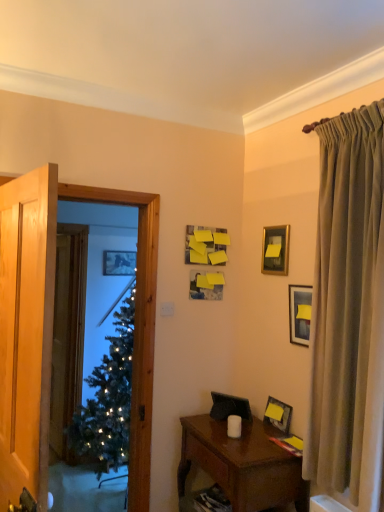
Question: Relative to gold metallic picture frame at upper right, the 5th picture frame when ordered from bottom to top, is brown wooden nightstand at lower right in front or behind?

Choices:
 (A) front
 (B) behind

Answer: (A)

Question: Would you say brown wooden nightstand at lower right is inside or outside gold metallic picture frame at upper right, the 5th picture frame when ordered from bottom to top?

Choices:
 (A) inside
 (B) outside

Answer: (B)

Question: Estimate the real-world distances between objects in this image. Which object is farther from the yellow matte picture frame at upper right, positioned as the 4th picture frame in top-to-bottom order?

Choices:
 (A) yellow matte picture frame at upper center, which is the 3th picture frame in bottom-to-top order
 (B) matte black picture frame at right, the 2th picture frame when ordered from front to back
 (C) green frosted glass window screen at left
 (D) silky beige curtain at right
 (E) white matte candle at center

Answer: (C)

Question: Which of these objects is positioned farthest from the white matte candle at center?

Choices:
 (A) yellow matte picture frame at upper right, arranged as the first picture frame when viewed from the front
 (B) brown wooden nightstand at lower right
 (C) silky beige curtain at right
 (D) gold metallic picture frame at upper right, the 4th picture frame viewed from the left
 (E) yellow matte picture frame at upper center, which ranks as the second picture frame in back-to-front order

Answer: (D)